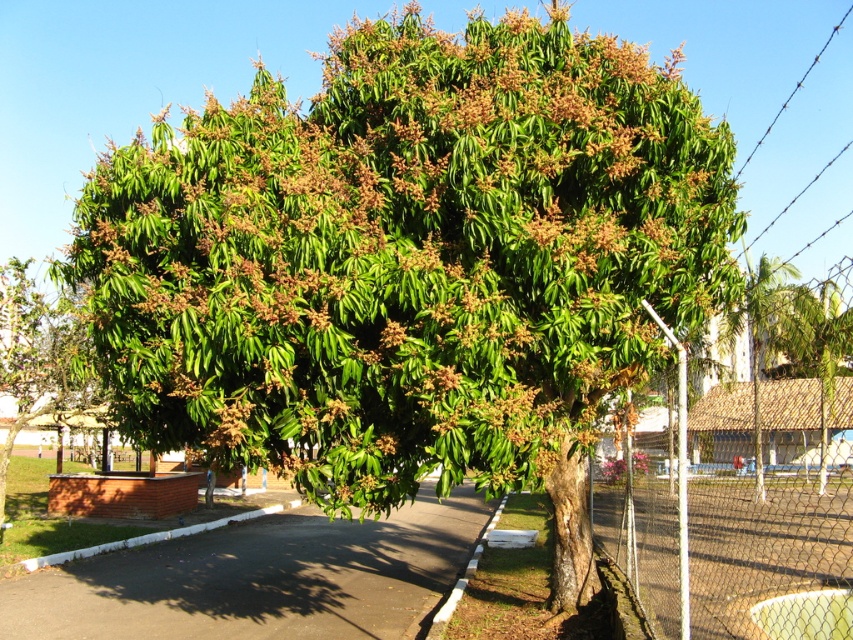
Question: Which point is closer to the camera taking this photo?

Choices:
 (A) (492, 525)
 (B) (83, 548)

Answer: (B)

Question: Which point is farther to the camera?

Choices:
 (A) wire mesh fence at right
 (B) white painted concrete curb at lower left

Answer: (B)

Question: Is green glossy tree at lower left further to the viewer compared to pink matte flower at center?

Choices:
 (A) no
 (B) yes

Answer: (A)

Question: Observing the image, what is the correct spatial positioning of wire mesh fence at right in reference to white painted concrete curb at lower left?

Choices:
 (A) right
 (B) left

Answer: (A)

Question: Which of these objects is positioned farthest from the pink matte flower at center?

Choices:
 (A) green glossy tree at lower left
 (B) wire mesh fence at right

Answer: (A)

Question: Where is wire mesh fence at right located in relation to green glossy tree at lower left in the image?

Choices:
 (A) below
 (B) above

Answer: (A)